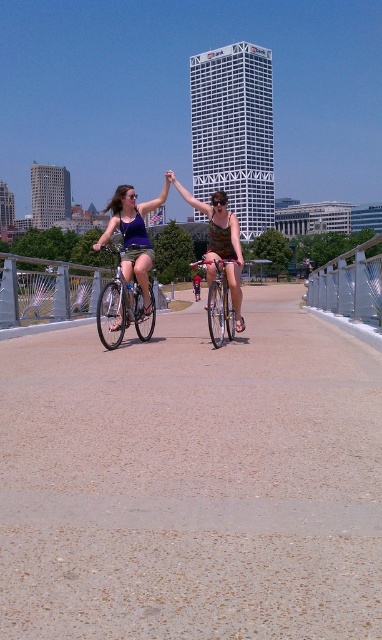
Question: Is smooth concrete path at center wider than matte purple tank top at center?

Choices:
 (A) yes
 (B) no

Answer: (B)

Question: Does matte purple tank top at center come in front of camouflage fabric dress at center?

Choices:
 (A) no
 (B) yes

Answer: (A)

Question: Which of these objects is positioned farthest from the matte purple tank top at center?

Choices:
 (A) smooth concrete path at center
 (B) silver metallic bicycle at center
 (C) camouflage fabric dress at center

Answer: (C)

Question: Which object is positioned closest to the shiny silver bicycle at center?

Choices:
 (A) smooth concrete path at center
 (B) silver metallic bicycle at center

Answer: (B)

Question: Which point is farther to the camera?

Choices:
 (A) (205, 262)
 (B) (271, 442)

Answer: (A)

Question: Can you confirm if smooth concrete path at center is positioned above matte purple tank top at center?

Choices:
 (A) yes
 (B) no

Answer: (B)